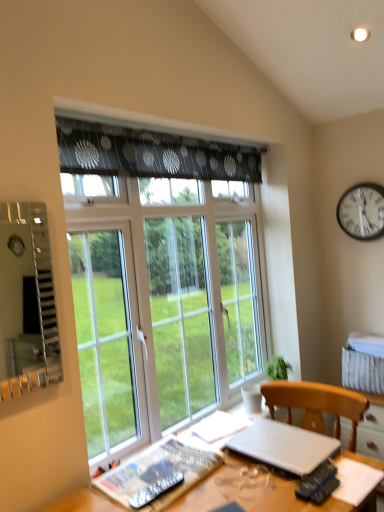
Identify the location of vacant space in between silver metallic laptop at lower right and metallic silver remote at lower center. (227, 479).